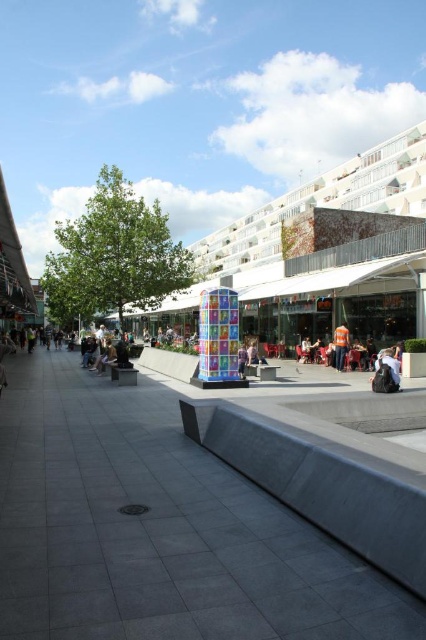
Question: Based on their relative distances, which object is farther from the multicolored glass sculpture at center?

Choices:
 (A) orange fabric bag at center
 (B) gray concrete pavement at center

Answer: (B)

Question: Is gray concrete pavement at center below multicolored glass sculpture at center?

Choices:
 (A) no
 (B) yes

Answer: (B)

Question: Estimate the real-world distances between objects in this image. Which object is closer to the multicolored glass sculpture at center?

Choices:
 (A) gray concrete pavement at center
 (B) light brown leather jacket at center

Answer: (B)

Question: Is orange fabric bag at center in front of light brown leather jacket at center?

Choices:
 (A) no
 (B) yes

Answer: (A)

Question: Does orange fabric bag at center have a smaller size compared to light brown leather jacket at center?

Choices:
 (A) yes
 (B) no

Answer: (A)

Question: Which point appears farthest from the camera in this image?

Choices:
 (A) (203, 534)
 (B) (342, 234)
 (C) (342, 349)

Answer: (B)